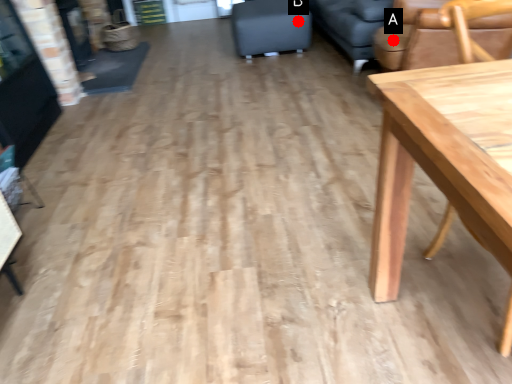
Question: Two points are circled on the image, labeled by A and B beside each circle. Which point is closer to the camera taking this photo?

Choices:
 (A) A is closer
 (B) B is closer

Answer: (A)